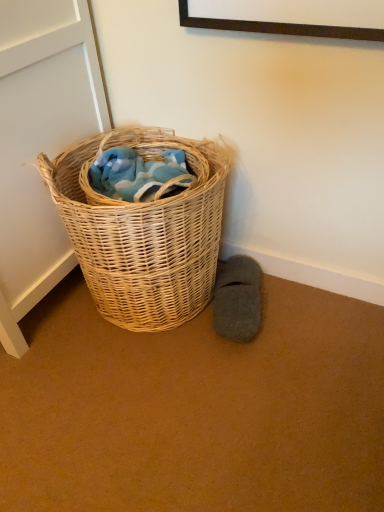
Question: Choose the correct answer: Is woven natural basket at lower left inside gray felt slipper at lower right or outside it?

Choices:
 (A) inside
 (B) outside

Answer: (B)

Question: Is point (105, 251) positioned closer to the camera than point (218, 268)?

Choices:
 (A) closer
 (B) farther

Answer: (A)

Question: Is woven natural basket at lower left to the left or to the right of gray felt slipper at lower right in the image?

Choices:
 (A) right
 (B) left

Answer: (B)

Question: Is gray felt slipper at lower right to the left or to the right of woven natural basket at lower left in the image?

Choices:
 (A) left
 (B) right

Answer: (B)

Question: Looking at their shapes, would you say gray felt slipper at lower right is wider or thinner than woven natural basket at lower left?

Choices:
 (A) thin
 (B) wide

Answer: (A)

Question: Is gray felt slipper at lower right taller or shorter than woven natural basket at lower left?

Choices:
 (A) short
 (B) tall

Answer: (A)

Question: Considering the positions of gray felt slipper at lower right and woven natural basket at lower left in the image, is gray felt slipper at lower right bigger or smaller than woven natural basket at lower left?

Choices:
 (A) small
 (B) big

Answer: (A)